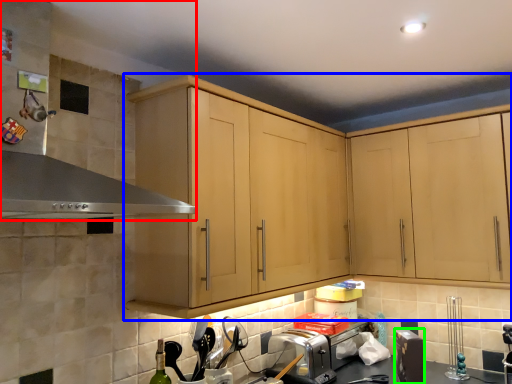
Question: Based on their relative distances, which object is nearer to exhaust hood (highlighted by a red box)? Choose from cabinetry (highlighted by a blue box) and appliance (highlighted by a green box).

Choices:
 (A) cabinetry
 (B) appliance

Answer: (A)